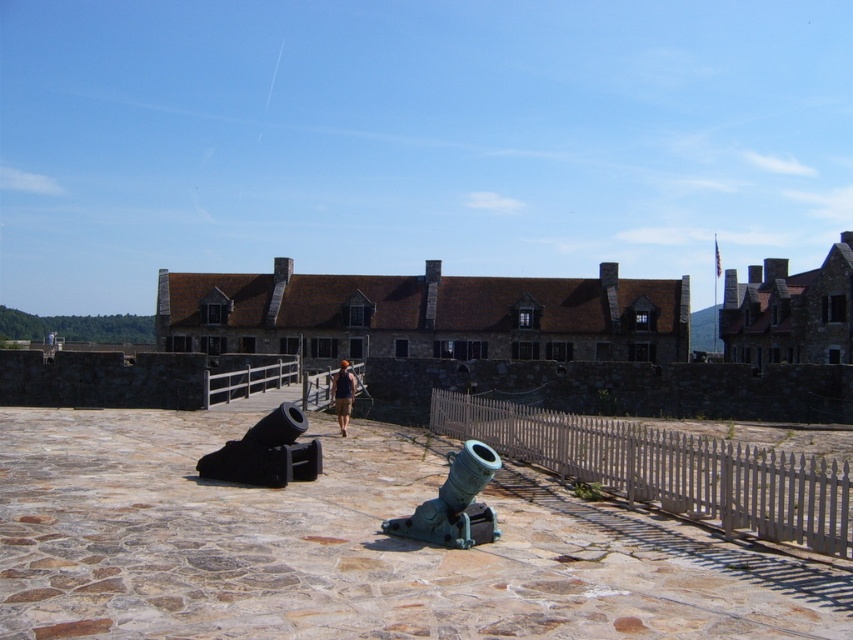
You are standing in front of the historical stone building and want to take a photo of the white picket fence at center and the green patina metal cannon at center. Which object will appear larger in your photo?

The white picket fence at center appears larger in the photo because it is much taller than the green patina metal cannon at center.

You are a painter standing at the entrance of the historical stone building. You need to decide whether to place a new sculpture between the white picket fence at center and the green patina metal cannon at center. Based on their widths, can the sculpture fit between them?

The white picket fence at center might be wider than the green patina metal cannon at center, so the sculpture may or may not fit depending on the sculpture size. Check the exact width difference first.

You are a tour guide leading a group around the historical site. You want to point out the distance between the white picket fence at center and the green patina metal cannon at center to your visitors. How far apart are they?

The white picket fence at center is 36.41 feet from the green patina metal cannon at center.